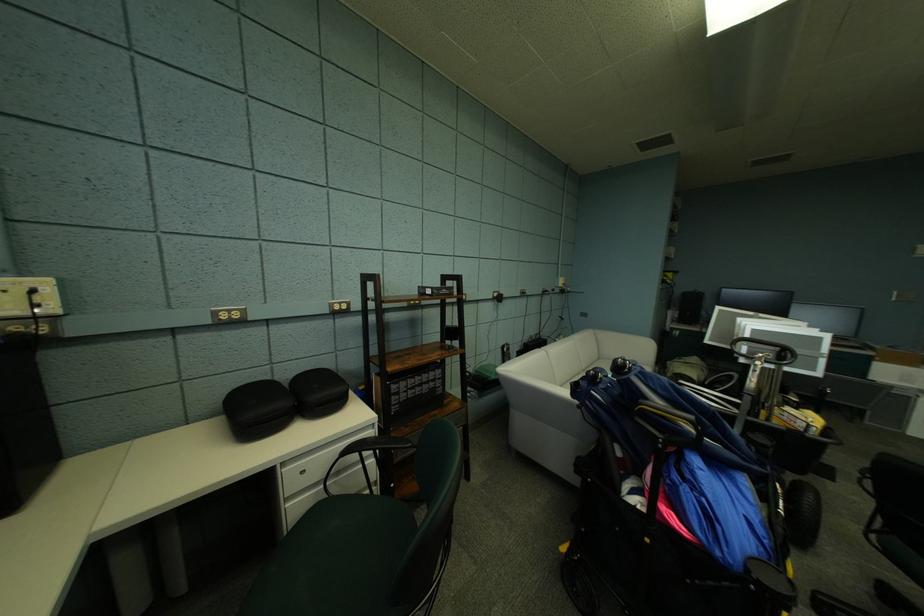
Locate an element on the screen. cart handle bar is located at coordinates (762, 351).